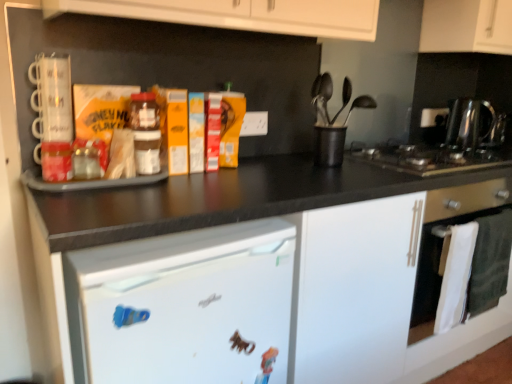
You are a GUI agent. You are given a task and a screenshot of the screen. Output one action in this format:
    pyautogui.click(x=<x>, y=<y>)
    Task: Click on the vacant area that is situated to the right of black plastic utensil holder at center
    This screenshot has width=512, height=384.
    Given the screenshot: What is the action you would take?
    pyautogui.click(x=370, y=160)